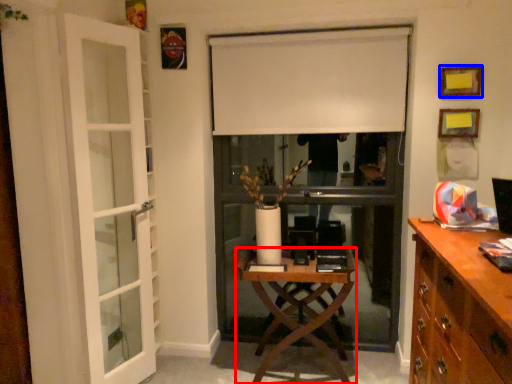
Question: Among these objects, which one is farthest to the camera, desk (highlighted by a red box) or picture frame (highlighted by a blue box)?

Choices:
 (A) desk
 (B) picture frame

Answer: (B)